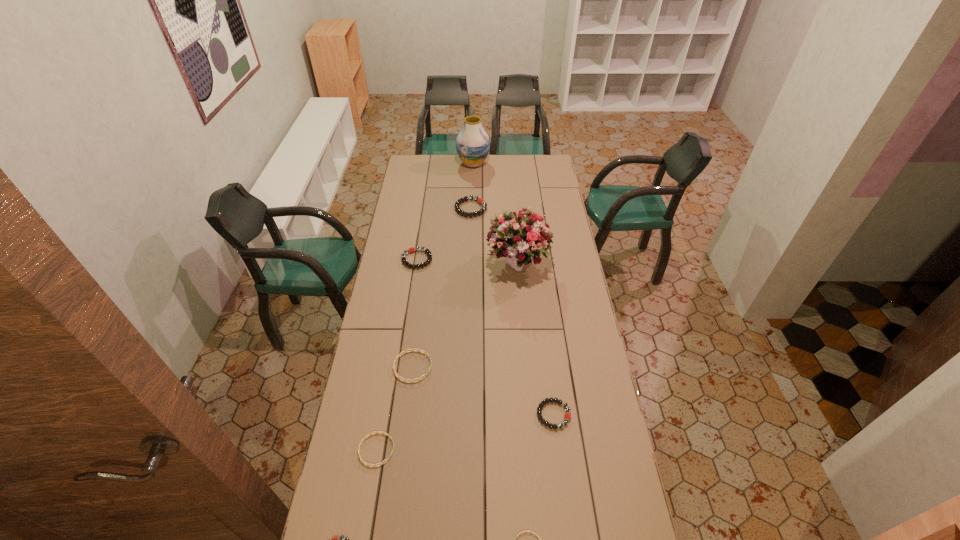
Where is `vacant space in between the farthest object and the third black bracelet from left to right`? The image size is (960, 540). vacant space in between the farthest object and the third black bracelet from left to right is located at coordinates (472, 186).

Identify the location of empty space between the second nearest blue bracelet and the farthest object. pos(425,307).

At what (x,y) coordinates should I click in order to perform the action: click on the third closest object to the shortest object. Please return your answer as a coordinate pair (x, y). The width and height of the screenshot is (960, 540). Looking at the image, I should click on 335,539.

Select which object appears as the closest to the rightmost black bracelet. Please provide its 2D coordinates. Your answer should be formatted as a tuple, i.e. [(x, y)], where the tuple contains the x and y coordinates of a point satisfying the conditions above.

[(540, 539)]

This screenshot has height=540, width=960. In order to click on the seventh closest bracelet relative to the vase in this screenshot , I will do `click(335, 539)`.

Identify which bracelet is the fourth nearest to the sixth shortest object. Please provide its 2D coordinates. Your answer should be formatted as a tuple, i.e. [(x, y)], where the tuple contains the x and y coordinates of a point satisfying the conditions above.

[(374, 465)]

You are a GUI agent. You are given a task and a screenshot of the screen. Output one action in this format:
    pyautogui.click(x=<x>, y=<y>)
    Task: Click on the black bracelet that stands as the second closest to the sixth shortest bracelet
    The image size is (960, 540).
    Given the screenshot: What is the action you would take?
    pyautogui.click(x=567, y=416)

Locate an element on the screen. This screenshot has height=540, width=960. the third closest black bracelet to the second nearest blue bracelet is located at coordinates point(410,250).

Locate an element on the screen. the closest blue bracelet relative to the smallest black bracelet is located at coordinates (374, 465).

Select which blue bracelet is the closest to the shortest bracelet. Please provide its 2D coordinates. Your answer should be formatted as a tuple, i.e. [(x, y)], where the tuple contains the x and y coordinates of a point satisfying the conditions above.

[(374, 465)]